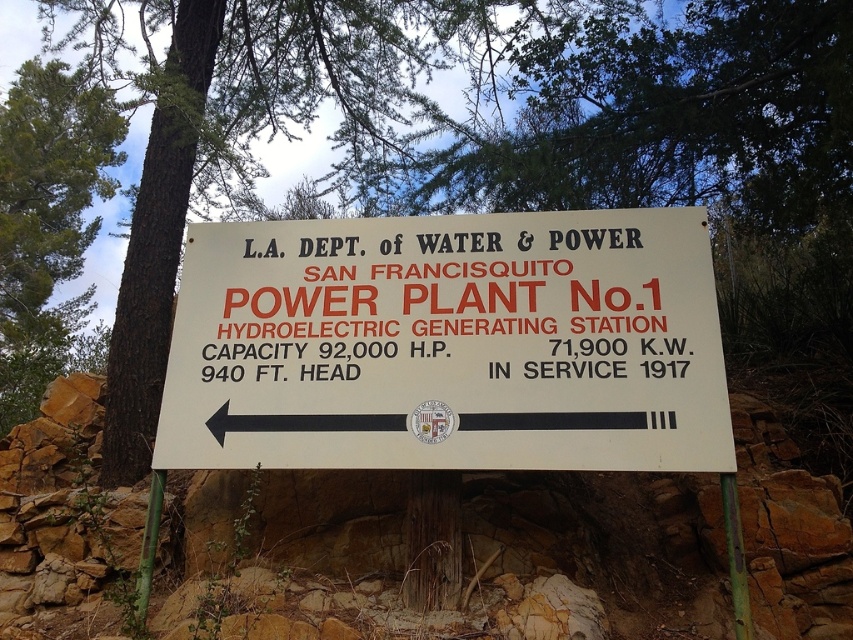
What are the coordinates of the white matte sign at center?

The white matte sign at center is located at coordinates point (448, 344).

You are standing at the entrance of the San Francisquito Power Plant No.1 and notice a green leafy tree at upper center and a green textured bark at upper left. Which object is closer to you?

The green leafy tree at upper center is 8.35 feet away from the green textured bark at upper left, so the tree is closer to you since it is positioned at the upper center compared to the bark at upper left.